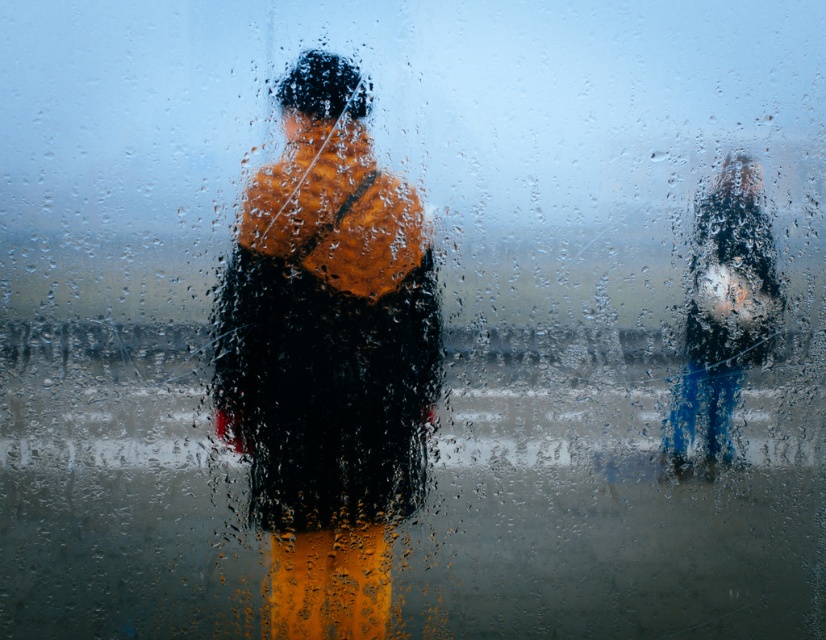
You are looking through the rain streaked window and see two points in the scene. The first point is at coordinates point [285,401] and the second is at point [730,396]. Which point is closer to you?

Point [285,401] is closer to the viewer than point [730,396].

You are a photographer trying to capture both the orange fabric jacket at center and the shiny black jacket at right in a single frame. Given that your camera has a minimum focus distance of 20 inches, will you be able to focus on both subjects clearly?

The orange fabric jacket at center and the shiny black jacket at right are 20.86 inches apart. Since the distance between them exceeds the camera minimum focus distance of 20 inches, the camera can focus on both subjects clearly.

You are observing a rainy scene through a window. You see an orange fabric jacket at center and a shiny black jacket at right. Which jacket is nearer to you?

The orange fabric jacket at center is closer to the viewer than the shiny black jacket at right.